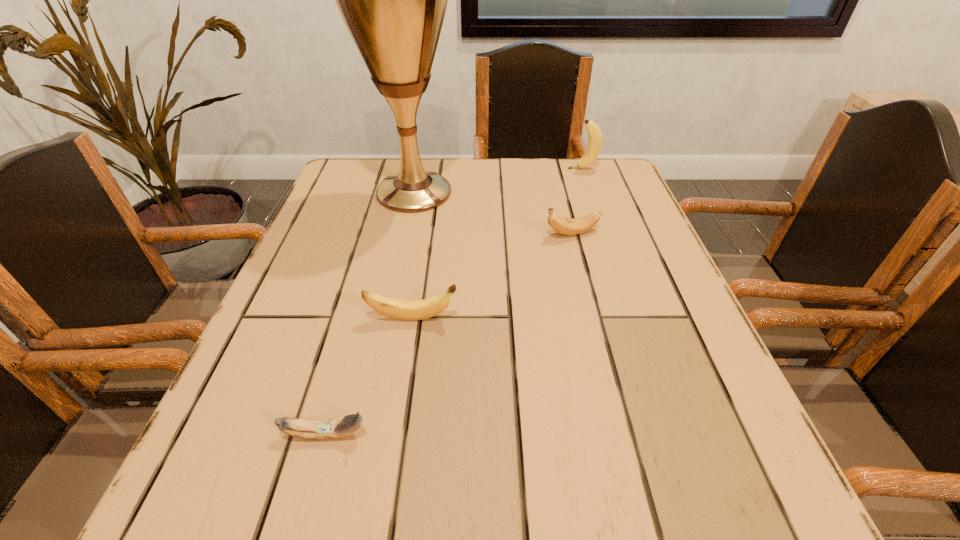
Where is `vacant point located between the nearest object and the tallest banana`? vacant point located between the nearest object and the tallest banana is located at coordinates (454, 301).

Identify the location of free space between the second farthest banana and the trophy cup. The width and height of the screenshot is (960, 540). (492, 213).

Identify the location of free space that is in between the trophy cup and the third farthest banana. (413, 255).

Locate an element on the screen. vacant space in between the nearest banana and the second farthest banana is located at coordinates coord(448,334).

At what (x,y) coordinates should I click in order to perform the action: click on object that is the second closest to the nearest banana. Please return your answer as a coordinate pair (x, y). Looking at the image, I should click on (393, 0).

Identify the location of the fourth closest object relative to the nearest object. pos(594,145).

Where is `the third closest banana relative to the trophy cup`? the third closest banana relative to the trophy cup is located at coordinates tap(400, 309).

This screenshot has height=540, width=960. What are the coordinates of `banana that is the second nearest to the farthest banana` in the screenshot? It's located at (400, 309).

Find the location of a particular element. blank area in the image that satisfies the following two spatial constraints: 1. on the front side of the third farthest object; 2. on the peel of the nearest banana is located at coordinates (624, 434).

Find the location of a particular element. The width and height of the screenshot is (960, 540). free space that satisfies the following two spatial constraints: 1. on the front side of the tallest object; 2. on the right side of the third nearest banana is located at coordinates (405, 233).